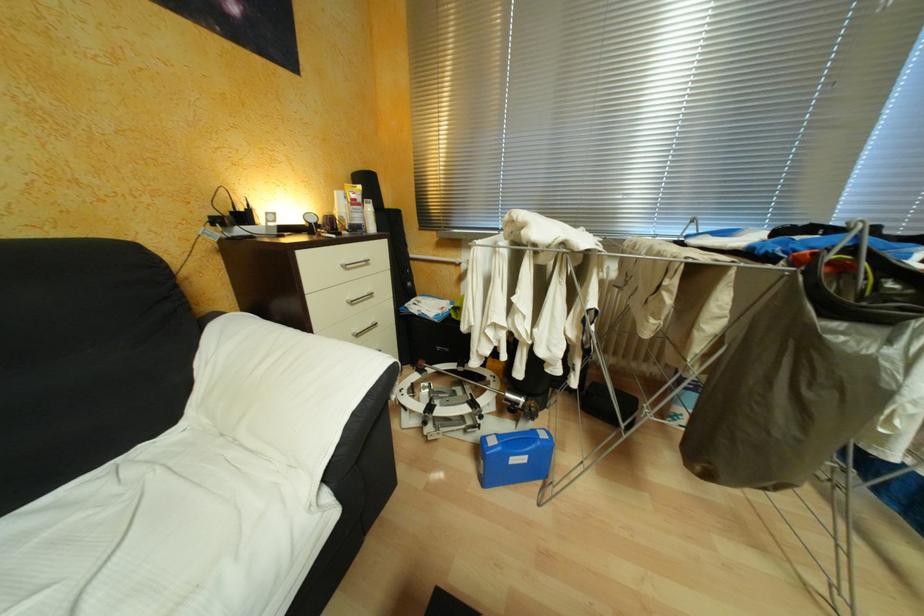
What do you see at coordinates (67, 541) in the screenshot?
I see `the sofa sitting surface` at bounding box center [67, 541].